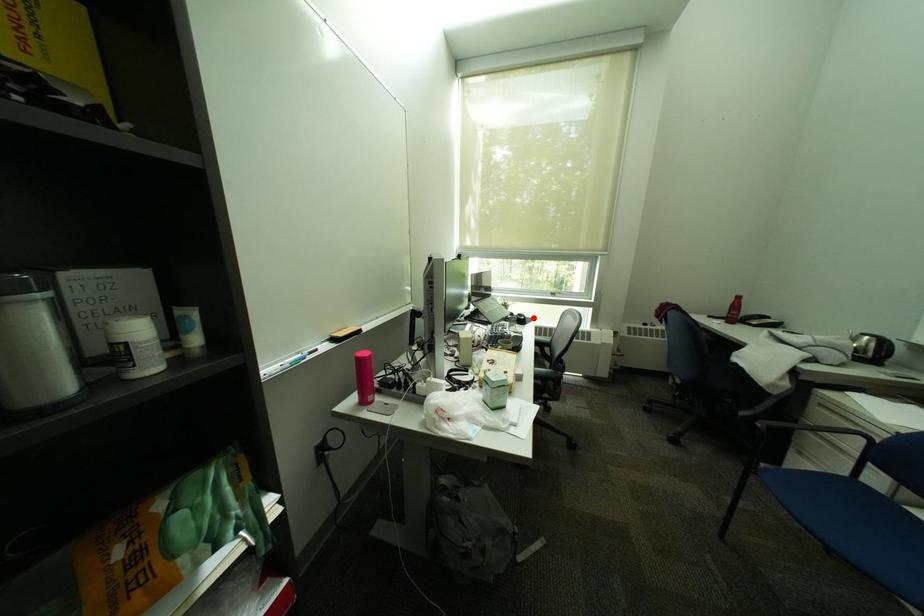
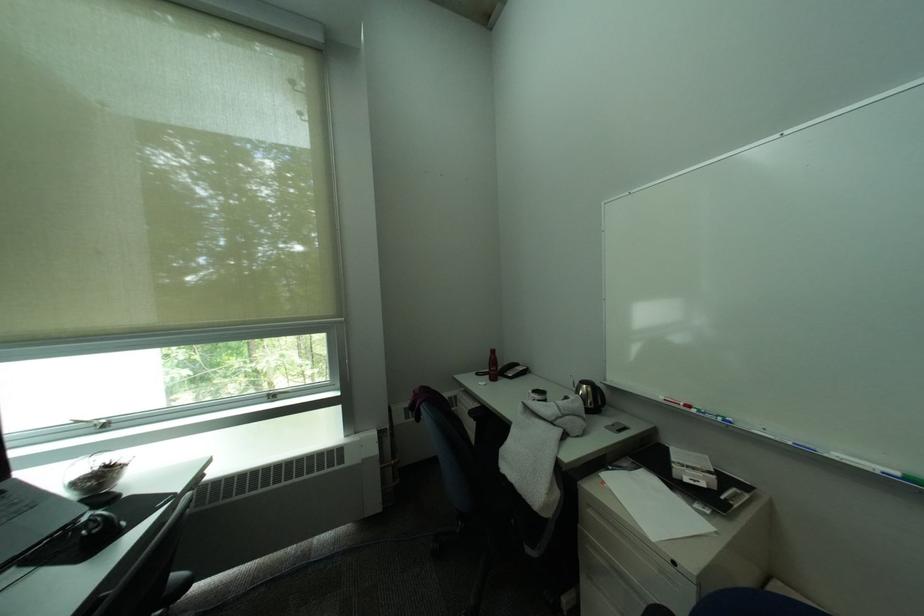
Where in the second image is the point corresponding to the highlighted location from the first image?

(106, 528)